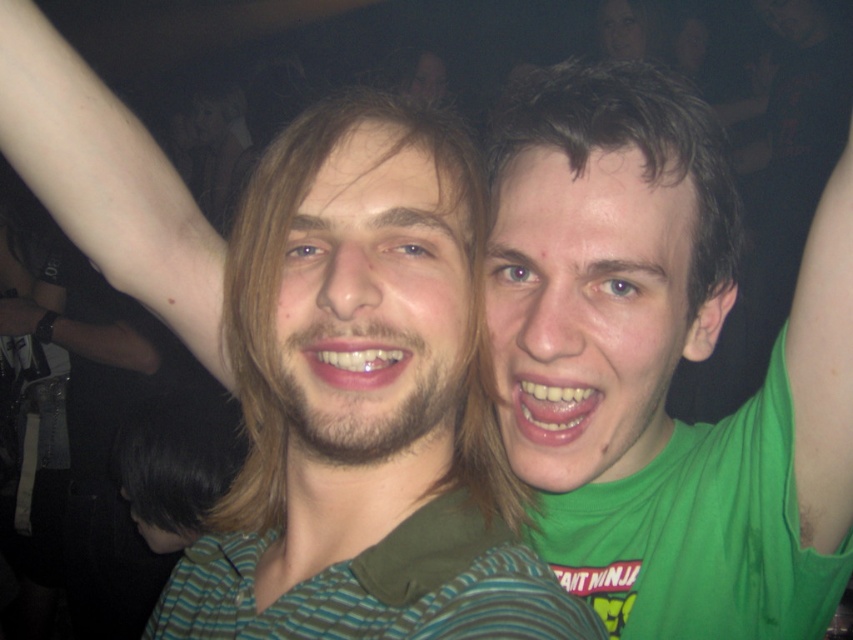
Which is above, green matte tank top at right or smooth skin face at upper right?

smooth skin face at upper right is above.

The height and width of the screenshot is (640, 853). What do you see at coordinates (660, 365) in the screenshot?
I see `green matte tank top at right` at bounding box center [660, 365].

The width and height of the screenshot is (853, 640). I want to click on green matte tank top at right, so click(x=660, y=365).

Is point (553, 608) positioned after point (637, 4)?

No, it is in front of (637, 4).

Can you confirm if green matte shirt at center is smaller than smooth skin face at upper right?

No.

Is point (253, 573) in front of point (648, 12)?

Yes, point (253, 573) is in front of point (648, 12).

Where is `green matte shirt at center`? green matte shirt at center is located at coordinates (310, 356).

In the scene shown: Is green matte shirt at center below green matte tank top at right?

No, green matte shirt at center is not below green matte tank top at right.

Is green matte shirt at center taller than green matte tank top at right?

Incorrect, green matte shirt at center's height is not larger of green matte tank top at right's.

The height and width of the screenshot is (640, 853). I want to click on green matte shirt at center, so click(x=310, y=356).